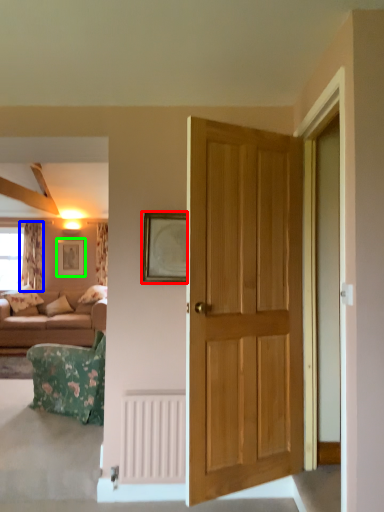
Question: Which is farther away from picture frame (highlighted by a red box)? curtain (highlighted by a blue box) or picture frame (highlighted by a green box)?

Choices:
 (A) curtain
 (B) picture frame

Answer: (B)